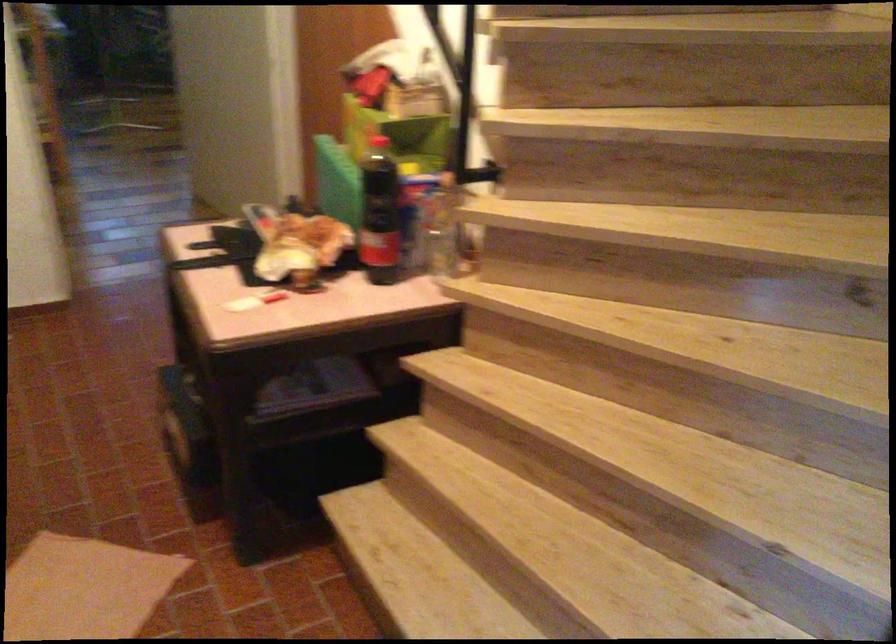
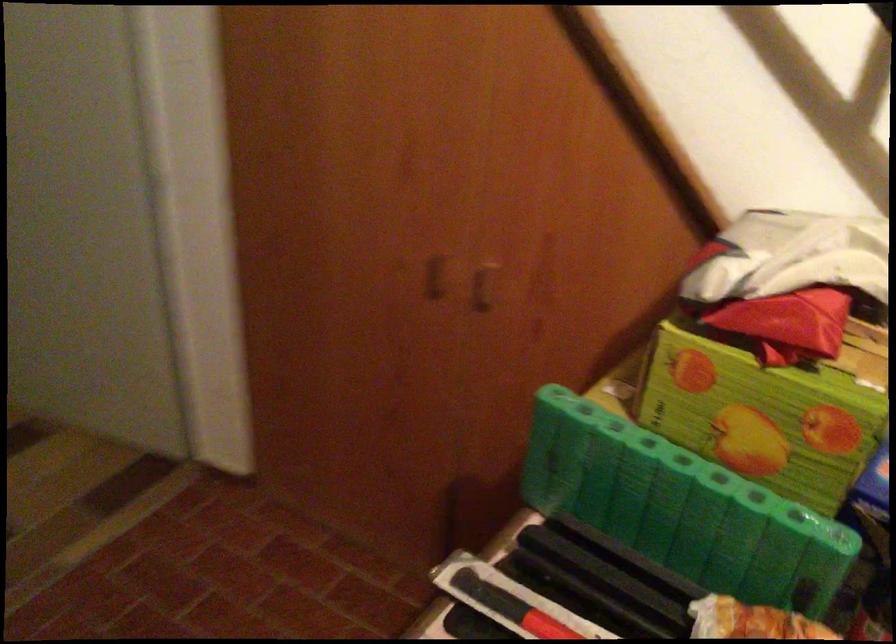
Locate, in the second image, the point that corresponds to point 350,122 in the first image.

(686, 377)